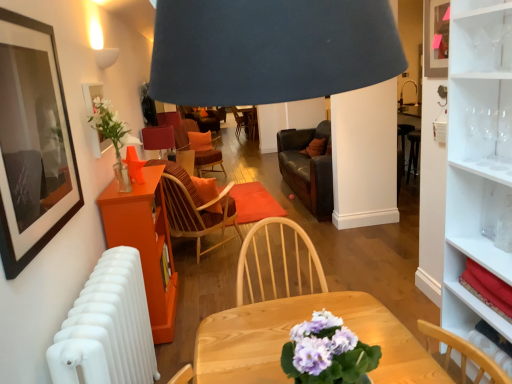
Question: Considering the relative sizes of brown striped fabric chair at center, which ranks as the 2th chair in back-to-front order, and clear glass wine glass at upper right, acting as the first wine glass starting from the right, in the image provided, is brown striped fabric chair at center, which ranks as the 2th chair in back-to-front order, shorter than clear glass wine glass at upper right, acting as the first wine glass starting from the right,?

Choices:
 (A) yes
 (B) no

Answer: (B)

Question: Is brown striped fabric chair at center, which ranks as the 2th chair in back-to-front order, positioned far away from clear glass wine glass at upper right, arranged as the third wine glass when viewed from the left?

Choices:
 (A) no
 (B) yes

Answer: (B)

Question: From a real-world perspective, is brown striped fabric chair at center, which ranks as the 2th chair in back-to-front order, physically above clear glass wine glass at upper right, acting as the first wine glass starting from the right?

Choices:
 (A) no
 (B) yes

Answer: (A)

Question: Is brown striped fabric chair at center, which ranks as the 2th chair in back-to-front order, at the right side of clear glass wine glass at upper right, arranged as the third wine glass when viewed from the left?

Choices:
 (A) no
 (B) yes

Answer: (A)

Question: Considering the relative sizes of brown striped fabric chair at center, the first chair in the front-to-back sequence, and clear glass wine glass at upper right, acting as the first wine glass starting from the right, in the image provided, is brown striped fabric chair at center, the first chair in the front-to-back sequence, thinner than clear glass wine glass at upper right, acting as the first wine glass starting from the right,?

Choices:
 (A) no
 (B) yes

Answer: (A)

Question: Does brown striped fabric chair at center, which ranks as the 2th chair in back-to-front order, have a smaller size compared to clear glass wine glass at upper right, arranged as the third wine glass when viewed from the left?

Choices:
 (A) yes
 (B) no

Answer: (B)

Question: Is orange fabric pillow at center located outside matte black picture frame at upper left, the 2th picture frame in the left-to-right sequence?

Choices:
 (A) yes
 (B) no

Answer: (A)

Question: Is orange fabric pillow at center facing away from matte black picture frame at upper left, arranged as the 2th picture frame when viewed from the back?

Choices:
 (A) no
 (B) yes

Answer: (A)

Question: Does orange fabric pillow at center have a lesser width compared to matte black picture frame at upper left, acting as the 1th picture frame starting from the right?

Choices:
 (A) no
 (B) yes

Answer: (A)

Question: Can you confirm if orange fabric pillow at center is smaller than matte black picture frame at upper left, positioned as the 1th picture frame in front-to-back order?

Choices:
 (A) yes
 (B) no

Answer: (A)

Question: Considering the relative sizes of orange fabric pillow at center and matte black picture frame at upper left, arranged as the 2th picture frame when viewed from the back, in the image provided, is orange fabric pillow at center shorter than matte black picture frame at upper left, arranged as the 2th picture frame when viewed from the back,?

Choices:
 (A) yes
 (B) no

Answer: (A)

Question: Does orange fabric pillow at center have a larger size compared to matte black picture frame at upper left, the 2th picture frame in the left-to-right sequence?

Choices:
 (A) no
 (B) yes

Answer: (A)

Question: Is white matte radiator at lower left at the right side of white glossy cabinet at upper right?

Choices:
 (A) yes
 (B) no

Answer: (B)